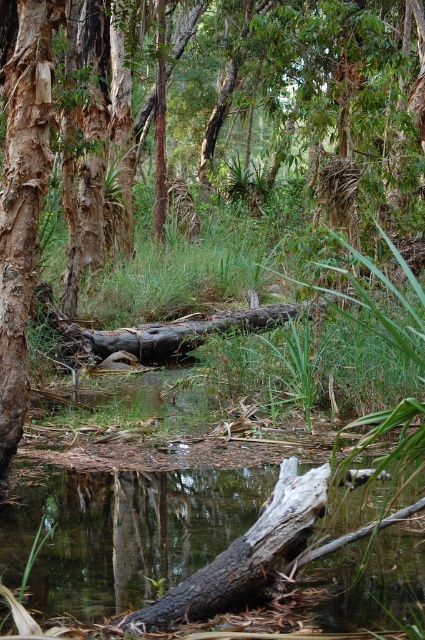
From the picture: Is transparent water at center below brown rough log at center?

Yes, transparent water at center is below brown rough log at center.

Which of these two, transparent water at center or brown rough log at center, stands taller?

brown rough log at center

Image resolution: width=425 pixels, height=640 pixels. Find the location of `transparent water at center`. transparent water at center is located at coordinates (146, 540).

Measure the distance from smooth bark tree trunk at left to brown rough log at center.

smooth bark tree trunk at left is 20.02 feet away from brown rough log at center.

Does smooth bark tree trunk at left appear on the left side of brown rough log at center?

Indeed, smooth bark tree trunk at left is positioned on the left side of brown rough log at center.

Find the location of `smooth bark tree trunk at left`. smooth bark tree trunk at left is located at coordinates (22, 202).

In the scene shown: Can you confirm if transparent water at center is shorter than smooth bark tree trunk at left?

Yes.

Can you confirm if transparent water at center is taller than smooth bark tree trunk at left?

In fact, transparent water at center may be shorter than smooth bark tree trunk at left.

Locate an element on the screen. Image resolution: width=425 pixels, height=640 pixels. transparent water at center is located at coordinates (146, 540).

This screenshot has height=640, width=425. Find the location of `transparent water at center`. transparent water at center is located at coordinates (146, 540).